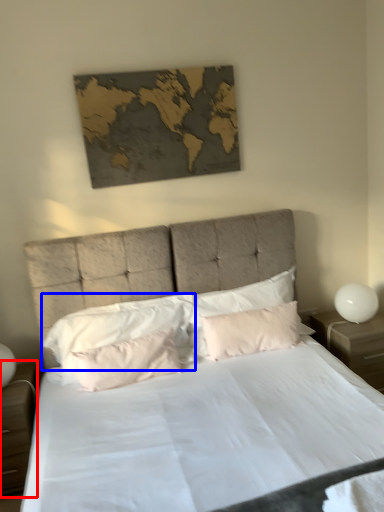
Question: Which object appears closest to the camera in this image, nightstand (highlighted by a red box) or pillow (highlighted by a blue box)?

Choices:
 (A) nightstand
 (B) pillow

Answer: (A)